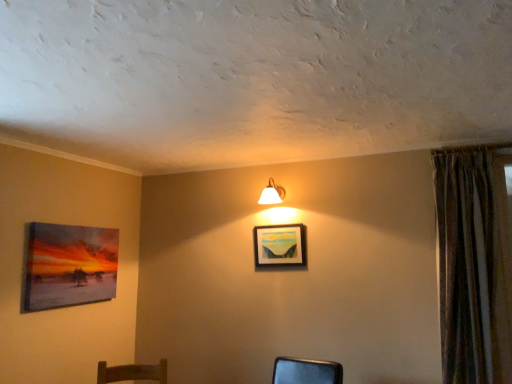
Question: Is white glossy wall lamp at upper center at the back of textured brown curtain at right?

Choices:
 (A) yes
 (B) no

Answer: (B)

Question: Is textured brown curtain at right positioned far away from white glossy wall lamp at upper center?

Choices:
 (A) yes
 (B) no

Answer: (A)

Question: Does textured brown curtain at right turn towards white glossy wall lamp at upper center?

Choices:
 (A) yes
 (B) no

Answer: (B)

Question: From the image's perspective, is textured brown curtain at right on top of white glossy wall lamp at upper center?

Choices:
 (A) yes
 (B) no

Answer: (B)

Question: Is textured brown curtain at right outside white glossy wall lamp at upper center?

Choices:
 (A) yes
 (B) no

Answer: (A)

Question: Considering the relative sizes of textured brown curtain at right and white glossy wall lamp at upper center in the image provided, is textured brown curtain at right wider than white glossy wall lamp at upper center?

Choices:
 (A) yes
 (B) no

Answer: (A)

Question: From a real-world perspective, is white glossy wall lamp at upper center positioned over matte wooden picture frame at center, which ranks as the first picture frame in right-to-left order, based on gravity?

Choices:
 (A) yes
 (B) no

Answer: (A)

Question: From a real-world perspective, is white glossy wall lamp at upper center physically below matte wooden picture frame at center, the second picture frame in the left-to-right sequence?

Choices:
 (A) no
 (B) yes

Answer: (A)

Question: Does white glossy wall lamp at upper center have a smaller size compared to matte wooden picture frame at center, which ranks as the first picture frame in right-to-left order?

Choices:
 (A) yes
 (B) no

Answer: (B)

Question: Is white glossy wall lamp at upper center oriented away from matte wooden picture frame at center, which ranks as the first picture frame in right-to-left order?

Choices:
 (A) no
 (B) yes

Answer: (A)

Question: Considering the relative sizes of white glossy wall lamp at upper center and matte wooden picture frame at center, the second picture frame in the left-to-right sequence, in the image provided, is white glossy wall lamp at upper center bigger than matte wooden picture frame at center, the second picture frame in the left-to-right sequence,?

Choices:
 (A) no
 (B) yes

Answer: (B)

Question: Does white glossy wall lamp at upper center appear on the left side of matte wooden picture frame at center, which ranks as the first picture frame in right-to-left order?

Choices:
 (A) yes
 (B) no

Answer: (A)

Question: Is matte canvas painting at left, positioned as the 1th picture frame in left-to-right order, bigger than matte wooden picture frame at center, which ranks as the first picture frame in right-to-left order?

Choices:
 (A) yes
 (B) no

Answer: (A)